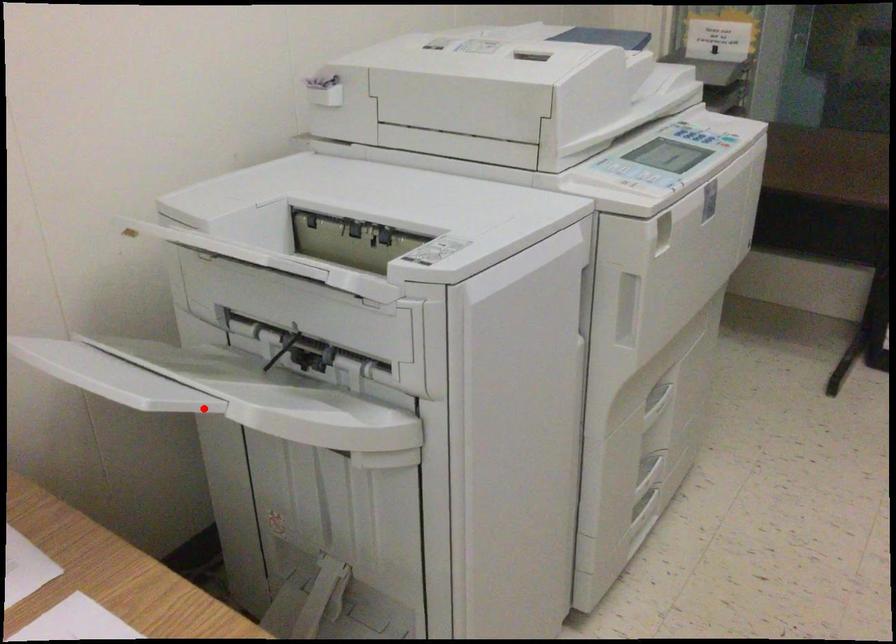
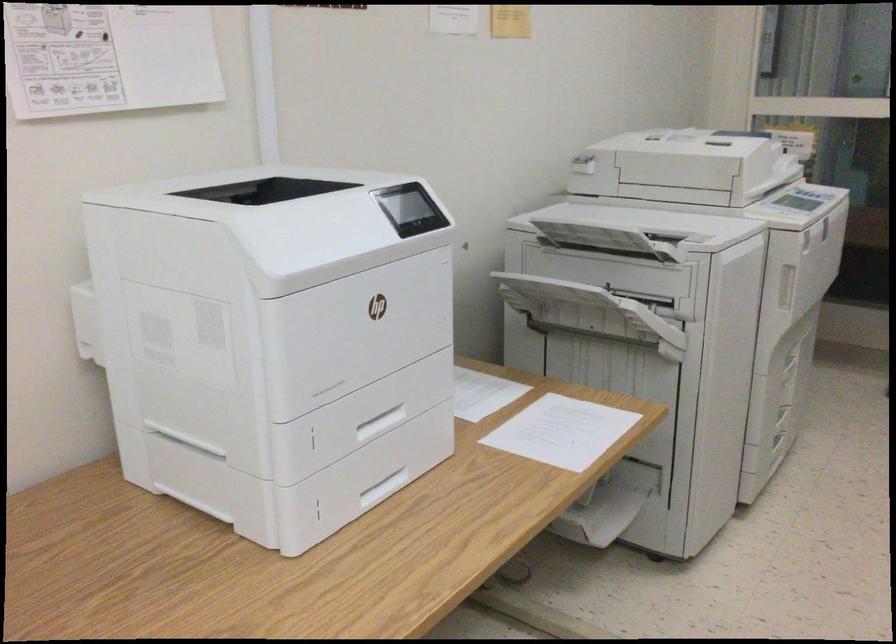
Question: I am providing you with two images of the same scene from different viewpoints. In image1, a red point is highlighted. Considering the same 3D point in image2, which of the following is correct?

Choices:
 (A) It is closer
 (B) It is farther

Answer: (B)